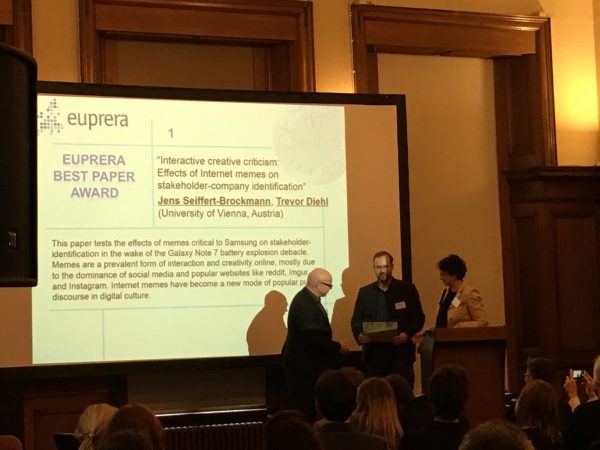
Locate an element on the screen. The width and height of the screenshot is (600, 450). brown wood frame is located at coordinates (546, 24).